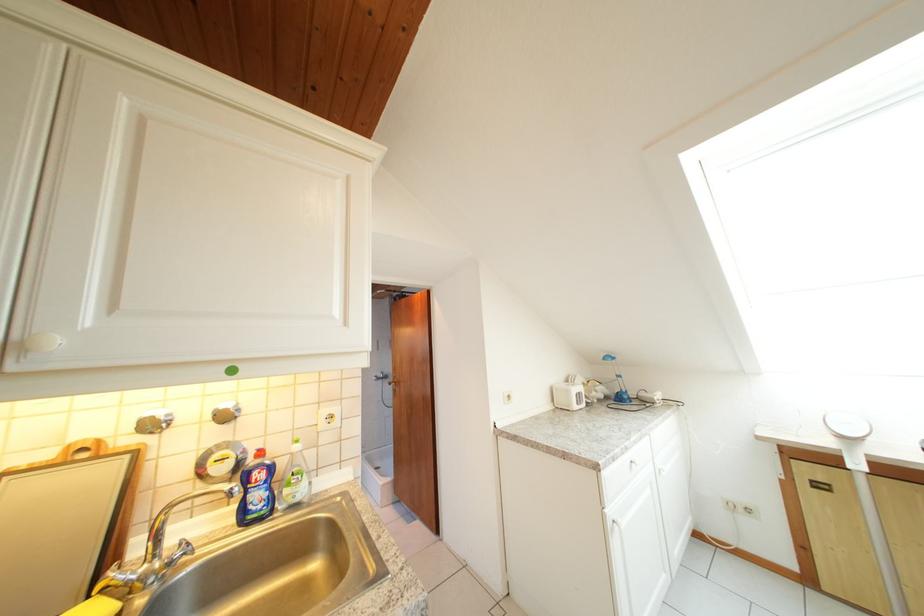
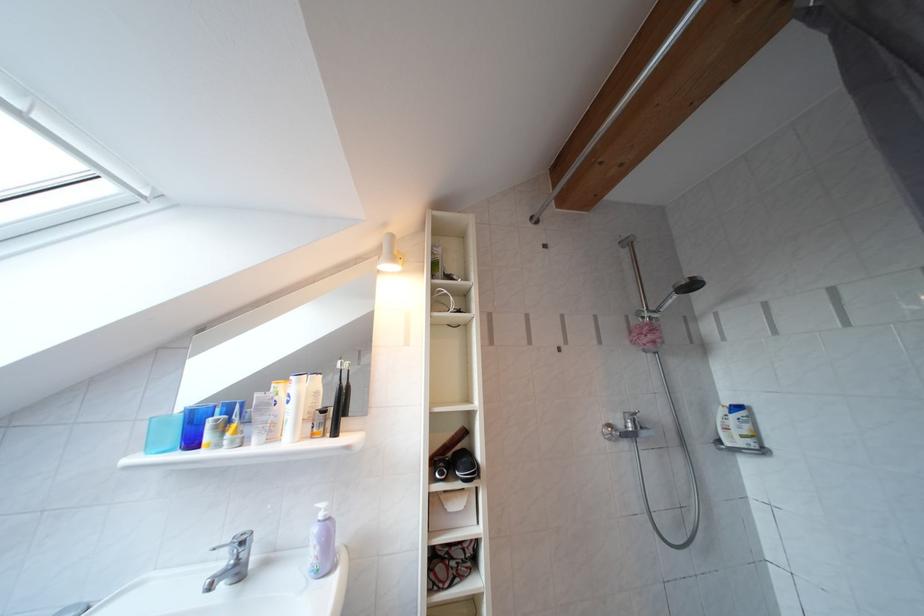
In a continuous first-person perspective shot, in which direction is the camera moving?

The cameraman walked toward left, forward.